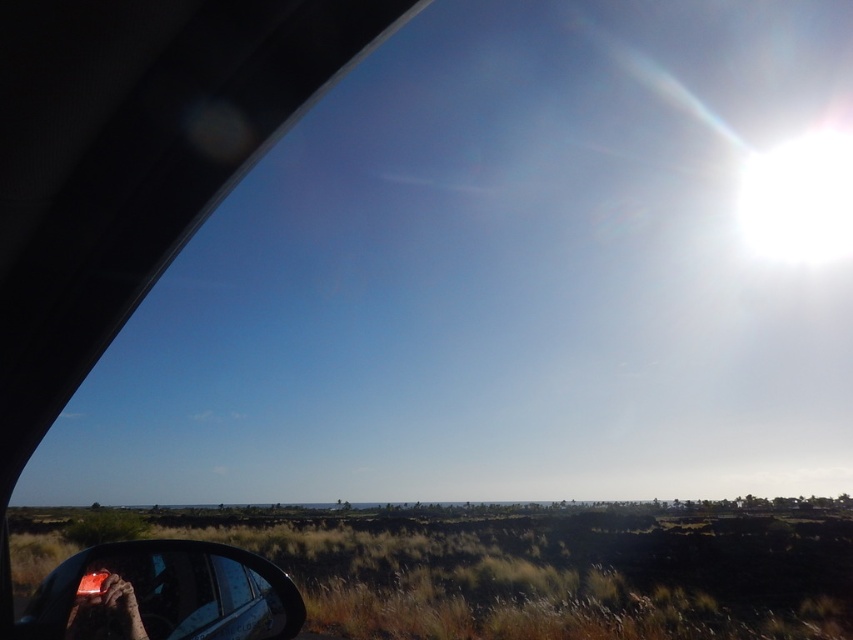
Does grassy field at lower center appear over leather glove at lower left?

Incorrect, grassy field at lower center is not positioned above leather glove at lower left.

In the scene shown: Can you confirm if grassy field at lower center is bigger than leather glove at lower left?

Yes, grassy field at lower center is bigger than leather glove at lower left.

Who is more forward, (347, 625) or (115, 618)?

Positioned in front is point (115, 618).

Identify the location of grassy field at lower center. The height and width of the screenshot is (640, 853). (555, 570).

Which is in front, point (488, 540) or point (51, 634)?

Point (51, 634) is in front.

Is grassy field at lower center to the right of matte black rearview mirror at lower left from the viewer's perspective?

Indeed, grassy field at lower center is positioned on the right side of matte black rearview mirror at lower left.

Is point (497, 621) farther from camera compared to point (201, 584)?

Yes, it is.

At what (x,y) coordinates should I click in order to perform the action: click on grassy field at lower center. Please return your answer as a coordinate pair (x, y). Looking at the image, I should click on (555, 570).

Is matte black rearview mirror at lower left thinner than leather glove at lower left?

Incorrect, matte black rearview mirror at lower left's width is not less than leather glove at lower left's.

Locate an element on the screen. The image size is (853, 640). matte black rearview mirror at lower left is located at coordinates (163, 595).